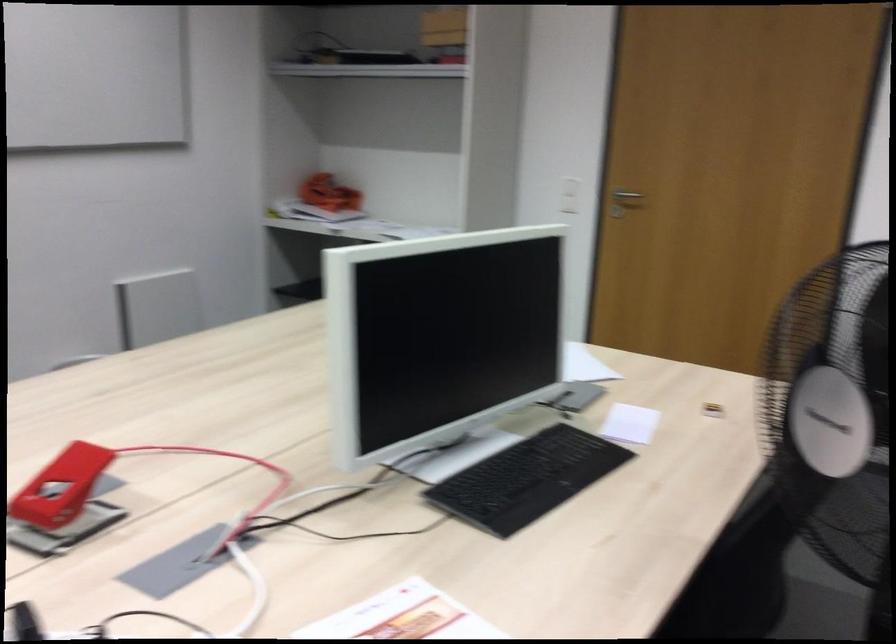
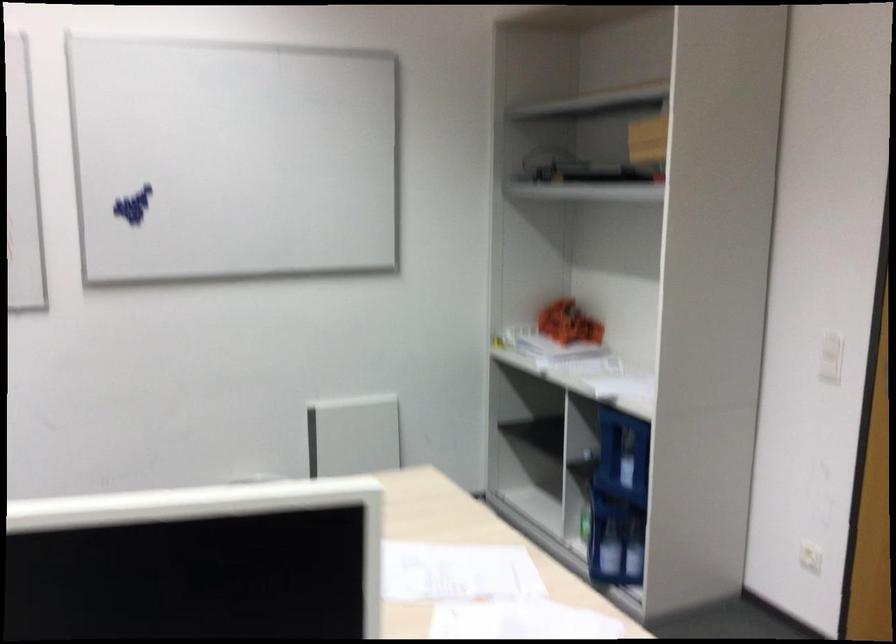
The point at (570,198) is marked in the first image. Where is the corresponding point in the second image?

(830, 357)